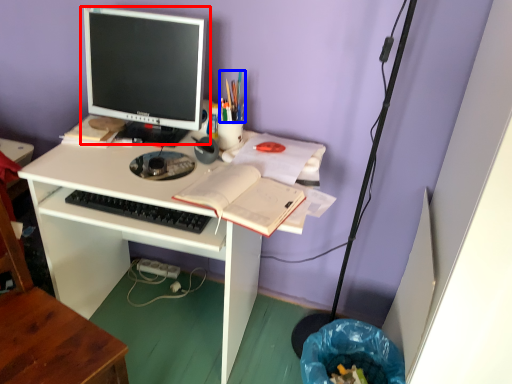
Question: Which of the following is the farthest to the observer, computer monitor (highlighted by a red box) or stationery (highlighted by a blue box)?

Choices:
 (A) computer monitor
 (B) stationery

Answer: (B)